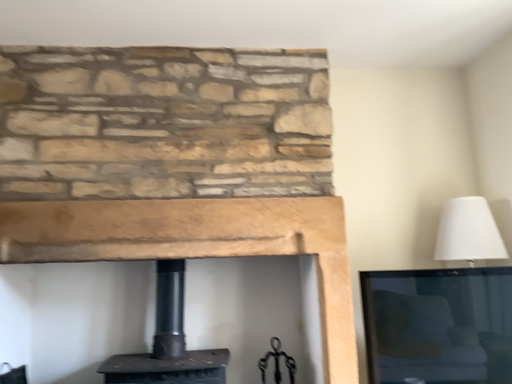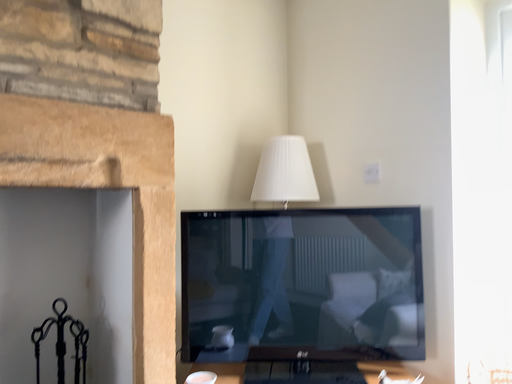
Question: Which way did the camera rotate in the video?

Choices:
 (A) rotated right
 (B) rotated left

Answer: (A)